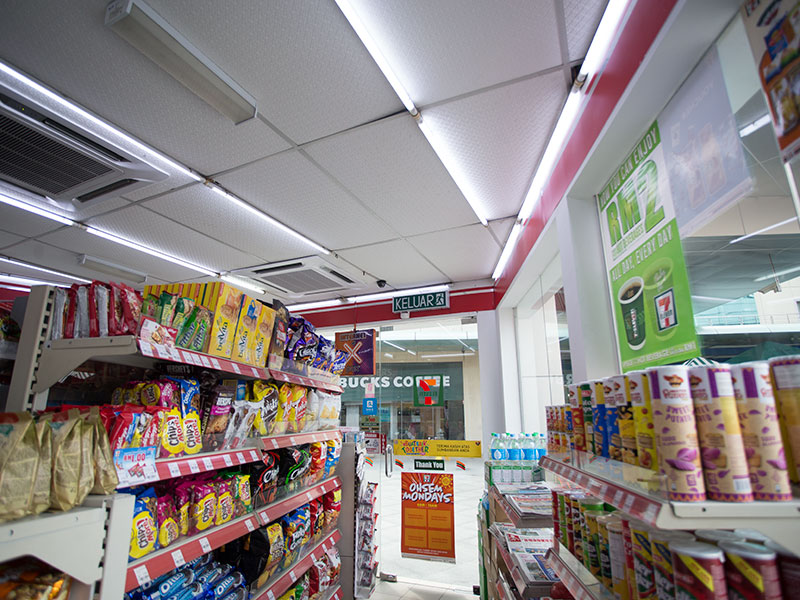
Locate an element on the screen. air conditioning vents is located at coordinates (302, 292), (56, 175).